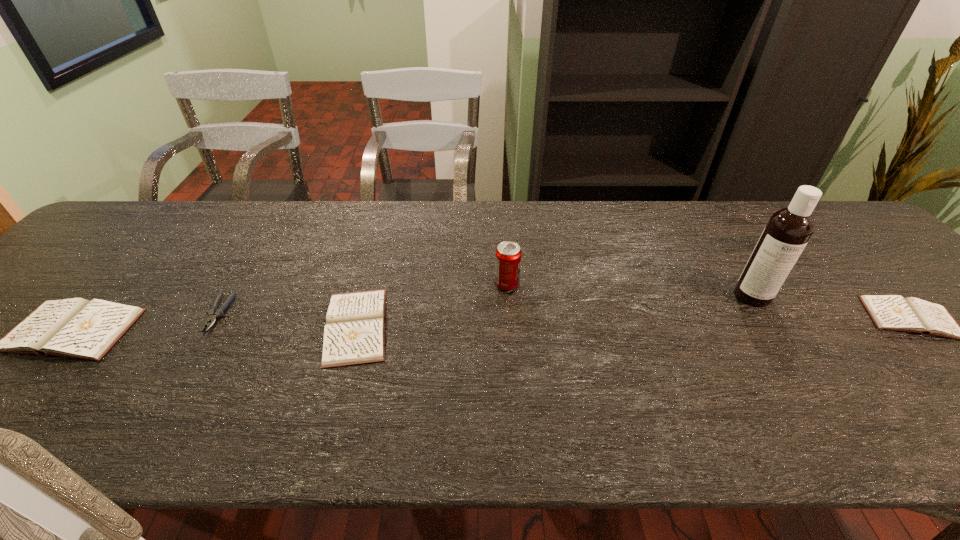
Identify the location of the fourth object from right to left. The image size is (960, 540). (354, 333).

You are a GUI agent. You are given a task and a screenshot of the screen. Output one action in this format:
    pyautogui.click(x=<x>, y=<y>)
    Task: Click on the second shortest diary
    The image size is (960, 540).
    Given the screenshot: What is the action you would take?
    pyautogui.click(x=354, y=333)

This screenshot has width=960, height=540. What are the coordinates of `the second tallest object` in the screenshot? It's located at (508, 254).

At what (x,y) coordinates should I click in order to perform the action: click on the third object from right to left. Please return your answer as a coordinate pair (x, y). Image resolution: width=960 pixels, height=540 pixels. Looking at the image, I should click on (508, 254).

The image size is (960, 540). Find the location of `dishwasher detergent`. dishwasher detergent is located at coordinates (x=788, y=230).

Where is `the tallest object`? the tallest object is located at coordinates (788, 230).

This screenshot has height=540, width=960. I want to click on the shortest object, so click(x=213, y=314).

At what (x,y) coordinates should I click in order to perform the action: click on pliers. Please return your answer as a coordinate pair (x, y). The width and height of the screenshot is (960, 540). Looking at the image, I should click on (213, 314).

This screenshot has width=960, height=540. Find the location of `free space located 0.300m on the back of the third shortest object`. free space located 0.300m on the back of the third shortest object is located at coordinates (385, 221).

This screenshot has width=960, height=540. I want to click on vacant area located on the left of the soda can, so click(x=432, y=284).